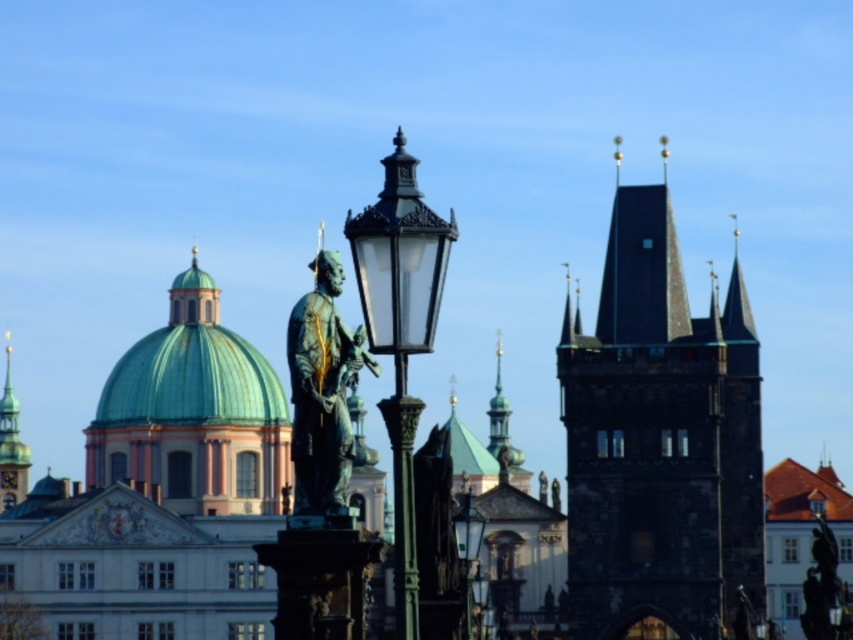
You are standing at the statue of the historical figure and want to walk towards the green dome building in the background. There are two points marked on the path. Which point should you step on first, point 1 at coordinates (215, 337) or point 2 at coordinates (1, 452)?

You should step on point 1 at coordinates (215, 337) first because it is in front of point 2 at coordinates (1, 452) along your path towards the green dome building.

You are a city planner reviewing the layout of this historical area. You need to install a new security camera on the matte black street light at center. The camera has a downward angle of 45 degrees. Will the camera be able to capture the bronze statue at center in its field of view?

The bronze statue at center is located below the matte black street light at center. Since the camera is mounted on the street light and has a downward angle of 45 degrees, it should be able to capture the bronze statue at center within its field of view.